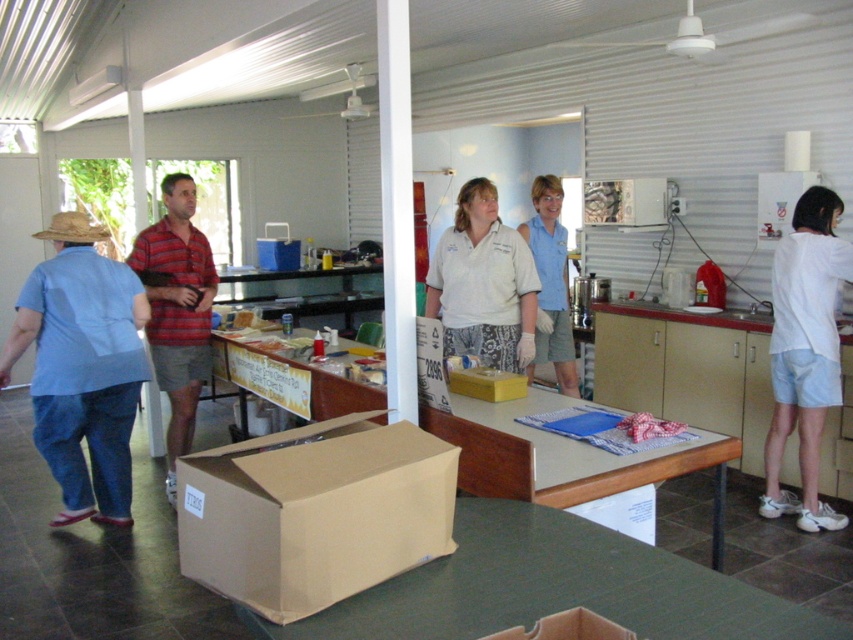
You are organizing items in the room and need to place a new item on the white cotton shirt at right. Can you place it directly on the brown cardboard box at lower center without moving the shirt?

The white cotton shirt at right is positioned over the brown cardboard box at lower center, so you cannot place the new item directly on the box without first removing the shirt.

You are organizing a charity event and need to place a white cotton shirt at center and a yellow cardboard box at center on a table. The table has limited space. Which item should you prioritize placing first to ensure both fit?

The white cotton shirt at center is bigger than the yellow cardboard box at center, so you should prioritize placing the white cotton shirt at center first to ensure both items fit on the table.

Consider the image. You are organizing items in a community center and need to place a new item between the white cotton shirt at center and the yellow cardboard box at center. Where should you place it to ensure it is between them?

Place the new item between the white cotton shirt at center and the yellow cardboard box at center so that it is to the right of the white cotton shirt at center and to the left of the yellow cardboard box at center.